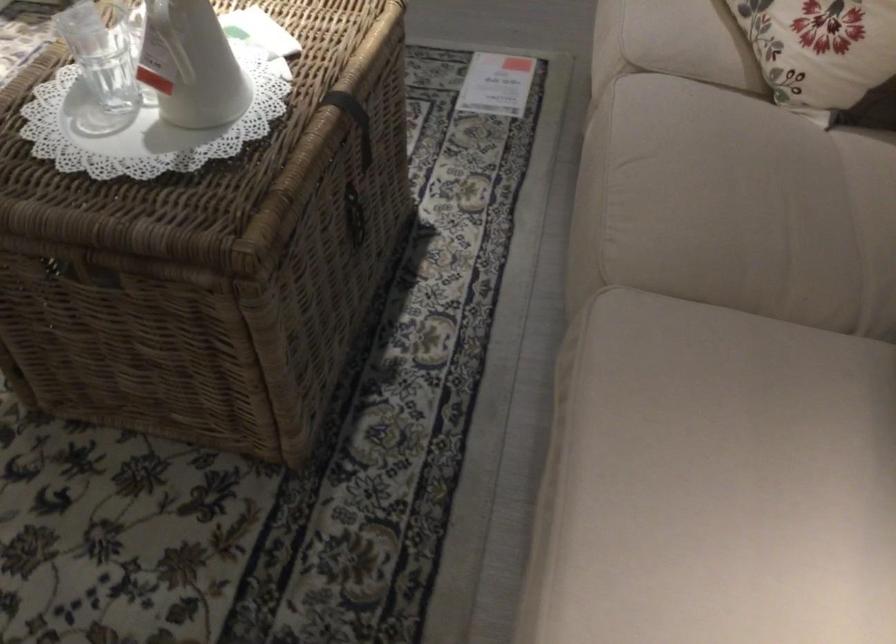
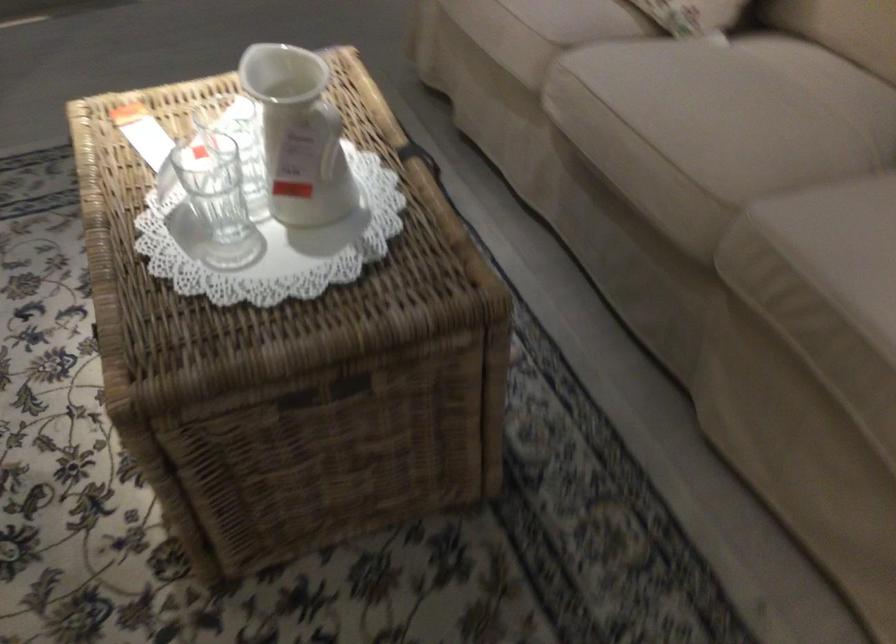
Where in the second image is the point corresponding to (x=112, y=73) from the first image?

(212, 205)